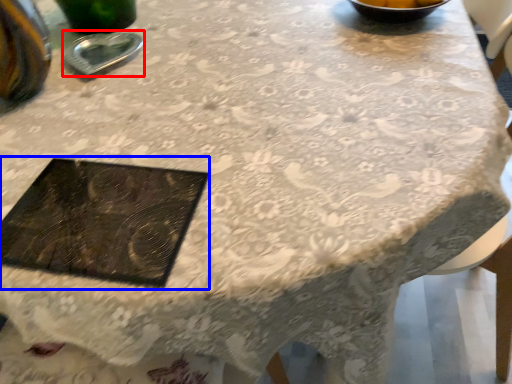
Question: Which of the following is the closest to the observer, tableware (highlighted by a red box) or tray (highlighted by a blue box)?

Choices:
 (A) tableware
 (B) tray

Answer: (B)